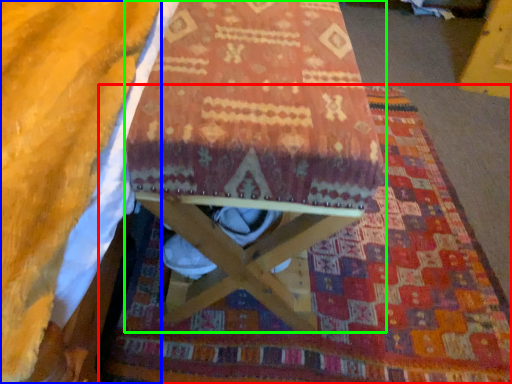
Question: Which is nearer to the mat (highlighted by a red box)? blanket (highlighted by a blue box) or furniture (highlighted by a green box).

Choices:
 (A) blanket
 (B) furniture

Answer: (B)